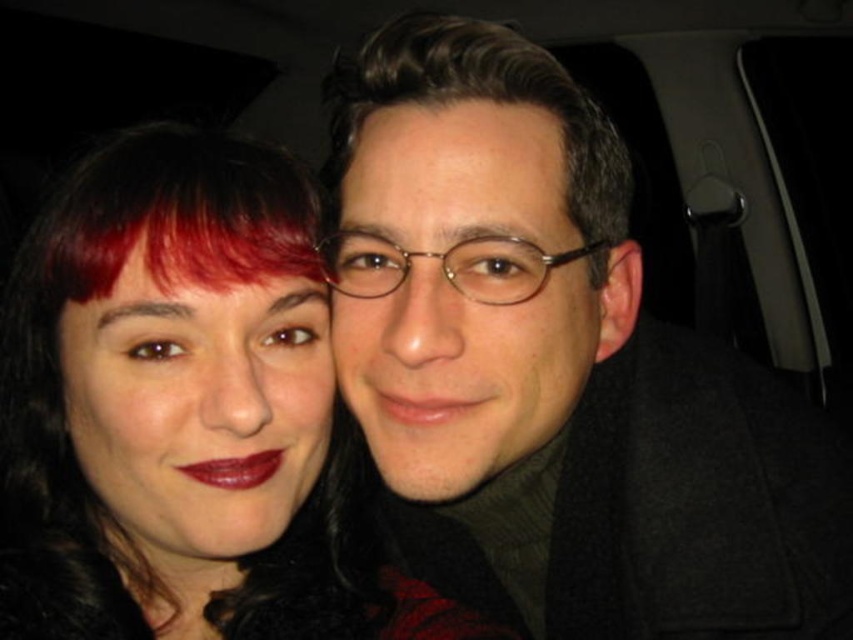
What is the exact coordinate of the matte black coat at center?

The matte black coat at center is located at point [556,368].

You are a photographer adjusting the framing for a portrait. You notice two people in the image with matte black hair at center and dark brown smooth hair at center. Which person should you focus on to ensure their hair detail is captured properly, considering their hair width?

The matte black hair at center has a greater width than the dark brown smooth hair at center. Therefore, focusing on the matte black hair at center would ensure capturing its wider hair detail properly.